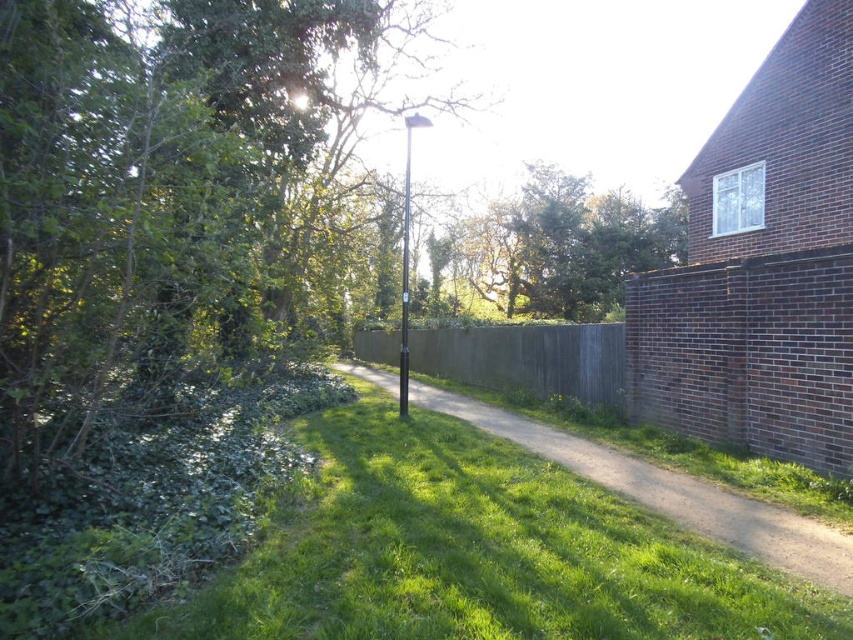
Question: Can you confirm if green leafy tree at upper left is wider than green leafy tree at center?

Choices:
 (A) no
 (B) yes

Answer: (A)

Question: Which of the following is the closest to the observer?

Choices:
 (A) (560, 371)
 (B) (300, 200)
 (C) (541, 276)

Answer: (A)

Question: Which of the following is the closest to the observer?

Choices:
 (A) wooden fence at center
 (B) green leafy tree at center
 (C) green leafy tree at upper left
 (D) dirt path at center

Answer: (D)

Question: Can you confirm if green leafy tree at center is wider than wooden fence at center?

Choices:
 (A) no
 (B) yes

Answer: (B)

Question: Is green leafy tree at upper left closer to camera compared to wooden fence at center?

Choices:
 (A) no
 (B) yes

Answer: (B)

Question: Among these objects, which one is farthest from the camera?

Choices:
 (A) dirt path at center
 (B) wooden fence at center
 (C) green leafy tree at upper left

Answer: (B)